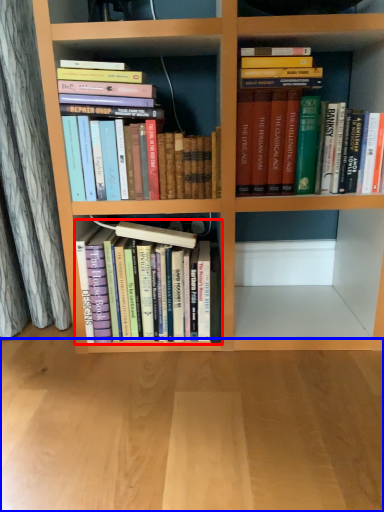
Question: Among these objects, which one is farthest to the camera, book (highlighted by a red box) or plain (highlighted by a blue box)?

Choices:
 (A) book
 (B) plain

Answer: (A)